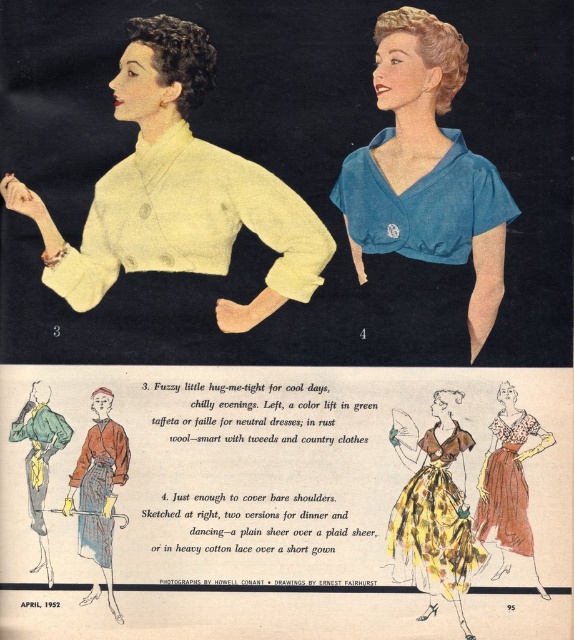
Question: Can you confirm if matte blue blouse at upper right is positioned above floral print cotton dress at lower right?

Choices:
 (A) no
 (B) yes

Answer: (B)

Question: Estimate the real-world distances between objects in this image. Which object is closer to the yellow floral fabric dress at lower right?

Choices:
 (A) matte blue blouse at upper right
 (B) rust wool robe at lower left
 (C) matte yellow sweater at center

Answer: (A)

Question: Which of the following is the farthest from the observer?

Choices:
 (A) floral print cotton dress at lower right
 (B) matte blue blouse at upper right

Answer: (A)

Question: Which of the following is the closest to the observer?

Choices:
 (A) (525, 545)
 (B) (26, 212)
 (C) (125, 464)

Answer: (B)

Question: Observing the image, what is the correct spatial positioning of matte yellow sweater at center in reference to floral print cotton dress at lower right?

Choices:
 (A) above
 (B) below

Answer: (A)

Question: Is matte yellow sweater at center below yellow floral fabric dress at lower right?

Choices:
 (A) no
 (B) yes

Answer: (A)